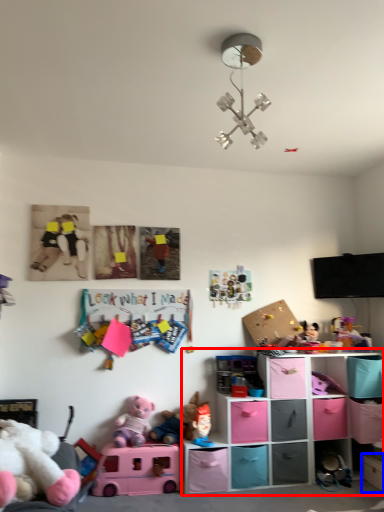
Question: Which object appears farthest to the camera in this image, shelf (highlighted by a red box) or shelf (highlighted by a blue box)?

Choices:
 (A) shelf
 (B) shelf

Answer: (A)